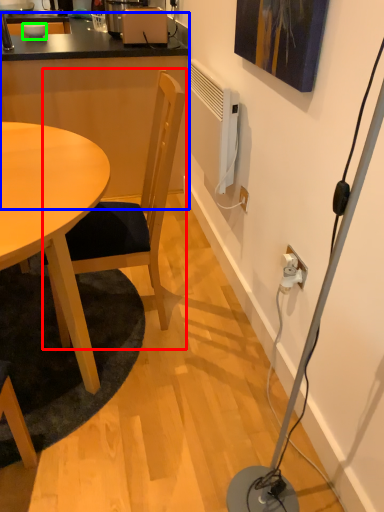
Question: Which object is the farthest from chair (highlighted by a red box)? Choose among these: computer desk (highlighted by a blue box) or bowl (highlighted by a green box).

Choices:
 (A) computer desk
 (B) bowl

Answer: (B)